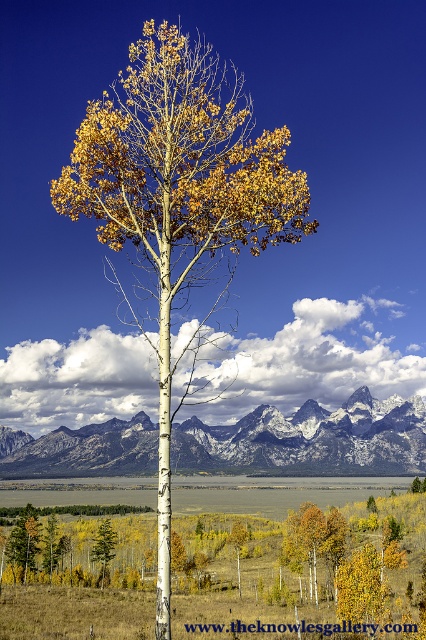
You are a hiker standing at the base of the matte white birch tree at center and want to take a photo of the snowy granite mountains at center. Can you see the entire mountain range clearly from your current position?

The matte white birch tree at center is positioned over snowy granite mountains at center, so the tree may block your view of the mountains. Move to a different location to get a clear shot of the snowy granite mountains at center.

Looking at this image, you are a hiker standing at the base of the matte white birch tree at center. You want to take a photo of the mountain range behind it. Where should you position yourself relative to the tree to ensure the mountains are fully visible in the background?

Since the matte white birch tree at center is positioned at coordinates 0.312 on the x and 0.423 on the y axis, you should position yourself to the right or left side of the tree to ensure the mountain range in the background is fully visible without obstruction.

You are a hiker standing in front of the matte white birch tree at center and the golden aspen tree at center. Which tree is positioned to the left?

The matte white birch tree at center is positioned to the left of the golden aspen tree at center.